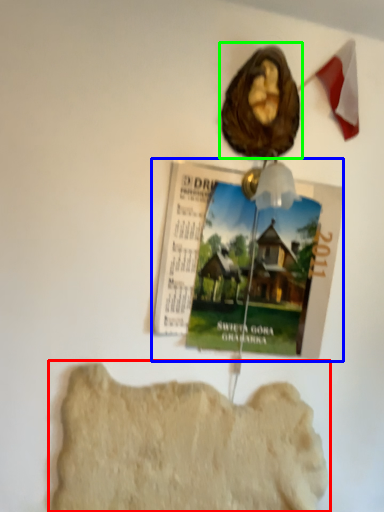
Question: Considering the real-world distances, which object is closest to rock formation (highlighted by a red box)? magazine (highlighted by a blue box) or art (highlighted by a green box).

Choices:
 (A) magazine
 (B) art

Answer: (A)